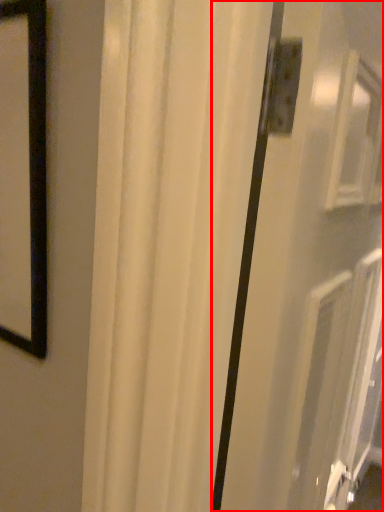
Question: From the image's perspective, what is the correct spatial positioning of screen door (annotated by the red box) in reference to curtain?

Choices:
 (A) above
 (B) below

Answer: (A)